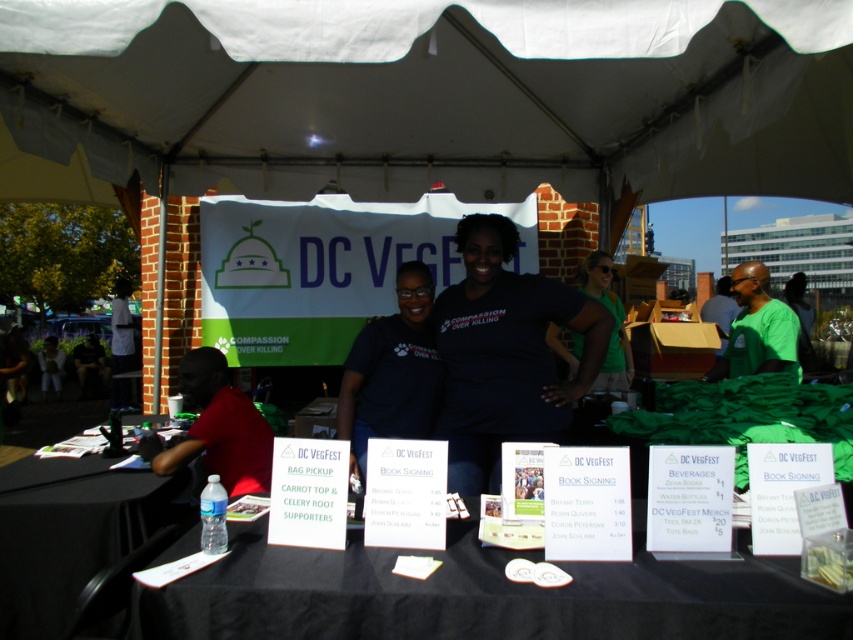
Question: Which of the following is the farthest from the observer?

Choices:
 (A) green matte shirt at right
 (B) black matte shirt at center
 (C) green t-shirt at center

Answer: (C)

Question: Which point appears farthest from the camera in this image?

Choices:
 (A) (769, 314)
 (B) (305, 170)
 (C) (438, 372)

Answer: (B)

Question: From the image, what is the correct spatial relationship of white paper sign at lower center in relation to dark blue shirt at center?

Choices:
 (A) above
 (B) below

Answer: (B)

Question: Which object is the closest to the white paper sign at lower center?

Choices:
 (A) black matte shirt at center
 (B) black fabric table at lower left
 (C) red shirt at left
 (D) white fabric canopy at upper center

Answer: (A)

Question: Where is white paper sign at lower center located in relation to green t-shirt at center in the image?

Choices:
 (A) left
 (B) right

Answer: (B)

Question: Is white fabric canopy at upper center bigger than white paper sign at lower center?

Choices:
 (A) yes
 (B) no

Answer: (A)